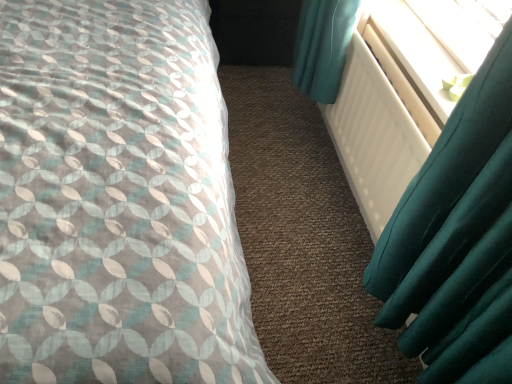
Where is `white matte radiator at right`? The height and width of the screenshot is (384, 512). white matte radiator at right is located at coordinates (378, 128).

At what (x,y) coordinates should I click in order to perform the action: click on black matte box at center. Please return your answer as a coordinate pair (x, y). The height and width of the screenshot is (384, 512). Looking at the image, I should click on (255, 31).

The width and height of the screenshot is (512, 384). Describe the element at coordinates (429, 44) in the screenshot. I see `white plastic radiator at upper right` at that location.

The width and height of the screenshot is (512, 384). What do you see at coordinates (118, 199) in the screenshot?
I see `patterned fabric bed at left` at bounding box center [118, 199].

I want to click on white matte radiator at right, so click(x=378, y=128).

Is white plastic radiator at upper right not inside patterned fabric bed at left?

white plastic radiator at upper right lies outside patterned fabric bed at left's area.

Between white plastic radiator at upper right and patterned fabric bed at left, which one is positioned in front?

patterned fabric bed at left is in front.

Considering the relative sizes of white plastic radiator at upper right and patterned fabric bed at left in the image provided, is white plastic radiator at upper right shorter than patterned fabric bed at left?

Yes.

From the image's perspective, is white plastic radiator at upper right on white matte radiator at right?

Yes.

Is white plastic radiator at upper right oriented away from white matte radiator at right?

white plastic radiator at upper right does not have its back to white matte radiator at right.

Would you say white matte radiator at right is a long distance from white plastic radiator at upper right?

No, white matte radiator at right is not far from white plastic radiator at upper right.

Looking at this image, could you tell me if white matte radiator at right is turned towards white plastic radiator at upper right?

No.

From the image's perspective, is white matte radiator at right below white plastic radiator at upper right?

Yes, from the image's perspective, white matte radiator at right is below white plastic radiator at upper right.

From their relative heights in the image, would you say patterned fabric bed at left is taller or shorter than white matte radiator at right?

patterned fabric bed at left is taller than white matte radiator at right.

Which is in front, point (142, 150) or point (365, 32)?

The point (142, 150) is in front.

Can you confirm if patterned fabric bed at left is bigger than white matte radiator at right?

Yes.

From the image's perspective, is patterned fabric bed at left below white matte radiator at right?

Actually, patterned fabric bed at left appears above white matte radiator at right in the image.

Who is bigger, patterned fabric bed at left or black matte box at center?

With larger size is patterned fabric bed at left.

You are a GUI agent. You are given a task and a screenshot of the screen. Output one action in this format:
    pyautogui.click(x=<x>, y=<y>)
    Task: Click on the dark on the right of the patterned fabric bed at left
    
    Given the screenshot: What is the action you would take?
    pyautogui.click(x=255, y=31)

Does white plastic radiator at upper right turn towards black matte box at center?

No, white plastic radiator at upper right does not turn towards black matte box at center.

From a real-world perspective, who is located lower, white plastic radiator at upper right or black matte box at center?

In real-world perspective, black matte box at center is lower.

Is white plastic radiator at upper right outside of black matte box at center?

white plastic radiator at upper right is positioned outside black matte box at center.

Can you confirm if black matte box at center is thinner than white matte radiator at right?

In fact, black matte box at center might be wider than white matte radiator at right.

How many degrees apart are the facing directions of black matte box at center and white matte radiator at right?

They differ by 89.5 degrees in their facing directions.

Can you confirm if black matte box at center is positioned to the left of white matte radiator at right?

Indeed, black matte box at center is positioned on the left side of white matte radiator at right.

Locate an element on the screen. Image resolution: width=512 pixels, height=384 pixels. dark above the white matte radiator at right (from the image's perspective) is located at coordinates (255, 31).

This screenshot has width=512, height=384. What are the coordinates of `bed on the left of white plastic radiator at upper right` in the screenshot? It's located at (118, 199).

Where is `window screen that appears on the right of white matte radiator at right`? This screenshot has height=384, width=512. window screen that appears on the right of white matte radiator at right is located at coordinates (429, 44).

Based on their spatial positions, is white plastic radiator at upper right or patterned fabric bed at left further from black matte box at center?

patterned fabric bed at left is further to black matte box at center.

From the image, which object appears to be nearer to white plastic radiator at upper right, black matte box at center or patterned fabric bed at left?

patterned fabric bed at left is closer to white plastic radiator at upper right.

Based on their spatial positions, is black matte box at center or white matte radiator at right further from patterned fabric bed at left?

black matte box at center lies further to patterned fabric bed at left than the other object.

Based on their spatial positions, is black matte box at center or white plastic radiator at upper right further from white matte radiator at right?

black matte box at center.

Based on the photo, looking at the image, which one is located closer to white matte radiator at right, white plastic radiator at upper right or patterned fabric bed at left?

white plastic radiator at upper right.

From the image, which object appears to be nearer to patterned fabric bed at left, white matte radiator at right or white plastic radiator at upper right?

white matte radiator at right is positioned closer to the anchor patterned fabric bed at left.

From the image, which object appears to be nearer to white plastic radiator at upper right, black matte box at center or white matte radiator at right?

white matte radiator at right lies closer to white plastic radiator at upper right than the other object.

Looking at the image, which one is located closer to black matte box at center, patterned fabric bed at left or white matte radiator at right?

white matte radiator at right lies closer to black matte box at center than the other object.

Where is `window screen between patterned fabric bed at left and black matte box at center from front to back`? window screen between patterned fabric bed at left and black matte box at center from front to back is located at coordinates (429, 44).

Find the location of a particular element. The height and width of the screenshot is (384, 512). radiator located between patterned fabric bed at left and white plastic radiator at upper right in the depth direction is located at coordinates (378, 128).

Locate an element on the screen. The width and height of the screenshot is (512, 384). radiator between patterned fabric bed at left and black matte box at center along the z-axis is located at coordinates (378, 128).

Image resolution: width=512 pixels, height=384 pixels. I want to click on window screen between white matte radiator at right and black matte box at center along the z-axis, so click(x=429, y=44).